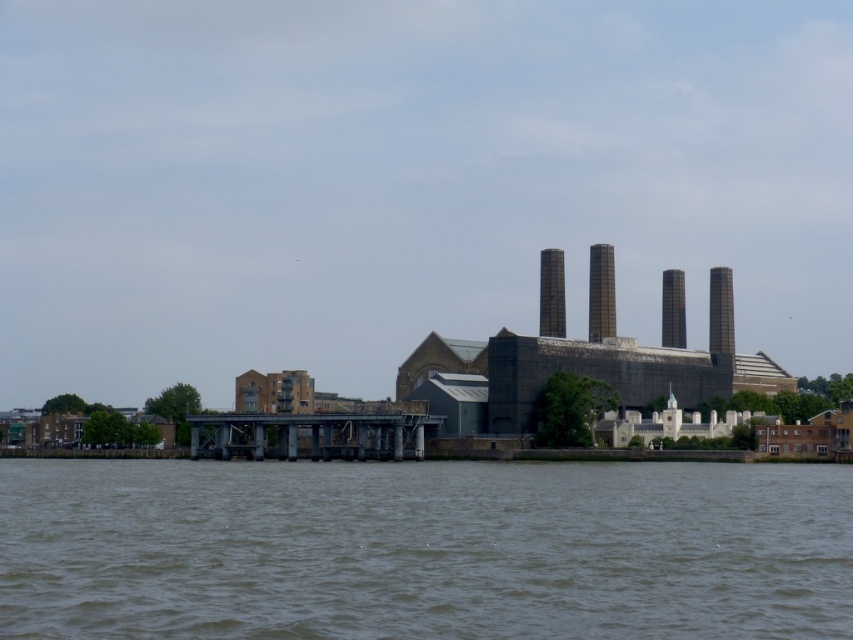
Question: Which point is farther to the camera?

Choices:
 (A) (602, 266)
 (B) (544, 310)
 (C) (721, 339)
 (D) (672, 342)

Answer: (C)

Question: Is brown concrete chimney at center behind black glass chimney at center?

Choices:
 (A) yes
 (B) no

Answer: (B)

Question: Which point is farther to the camera?

Choices:
 (A) (682, 305)
 (B) (552, 296)

Answer: (A)

Question: From the image, what is the correct spatial relationship of black glass chimney at center in relation to smooth metallic chimney at right?

Choices:
 (A) right
 (B) left

Answer: (B)

Question: Which of the following is the closest to the observer?

Choices:
 (A) (676, 275)
 (B) (560, 296)

Answer: (B)

Question: From the image, what is the correct spatial relationship of black glass chimney at center in relation to smooth gray chimney at center?

Choices:
 (A) above
 (B) below

Answer: (A)